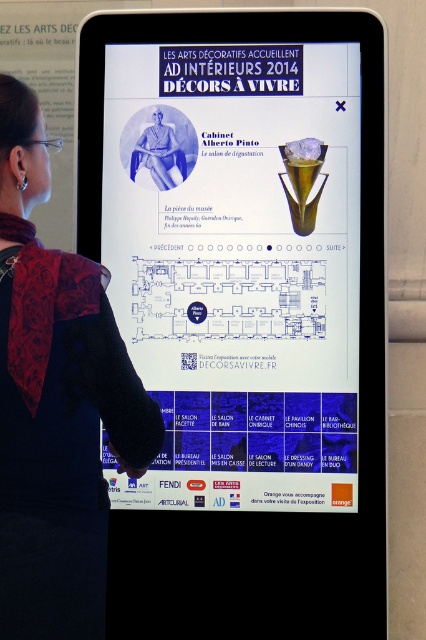
Question: Can you confirm if white glossy poster at center is positioned below black fabric at upper left?

Choices:
 (A) no
 (B) yes

Answer: (A)

Question: Which object is closer to the camera taking this photo?

Choices:
 (A) white glossy poster at center
 (B) black fabric at upper left

Answer: (B)

Question: Which object is closer to the camera taking this photo?

Choices:
 (A) white glossy poster at center
 (B) black fabric at upper left

Answer: (B)

Question: Does white glossy poster at center appear under black fabric at upper left?

Choices:
 (A) yes
 (B) no

Answer: (B)

Question: Is white glossy poster at center in front of black fabric at upper left?

Choices:
 (A) no
 (B) yes

Answer: (A)

Question: Which of the following is the closest to the observer?

Choices:
 (A) white glossy poster at center
 (B) black fabric at upper left

Answer: (B)